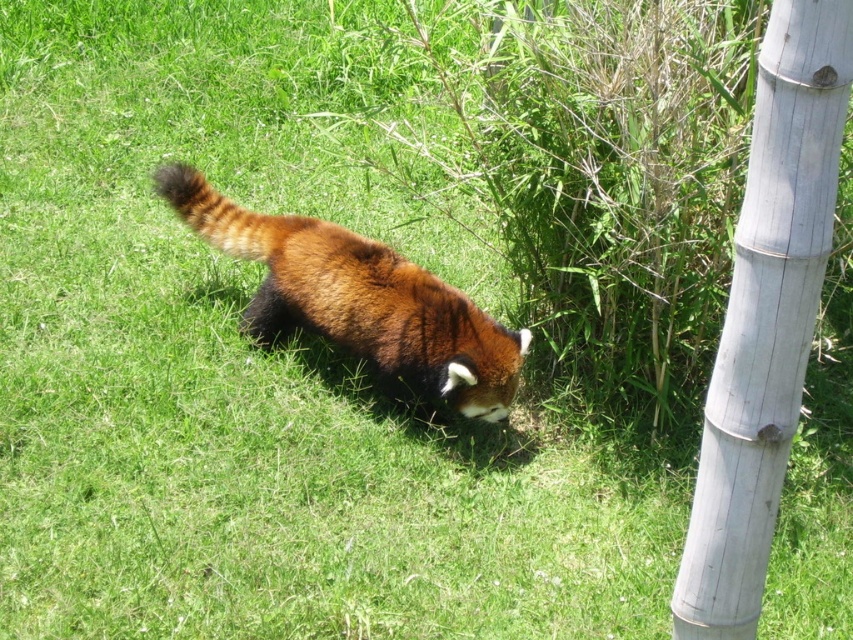
You are a zookeeper observing the red panda in its enclosure. You notice a point at coordinates [766,316]. What object in the enclosure is located at that point?

The white bamboo pole at right is located at point [766,316].